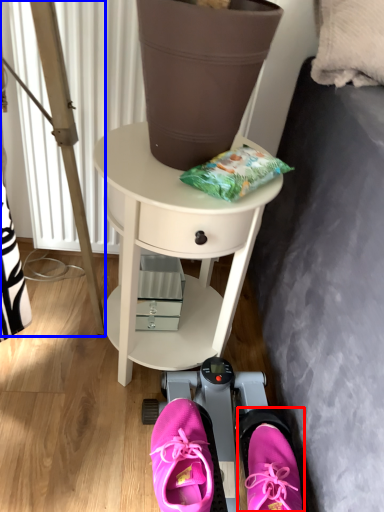
Question: Which object appears farthest to the camera in this image, footwear (highlighted by a red box) or ladder (highlighted by a blue box)?

Choices:
 (A) footwear
 (B) ladder

Answer: (B)